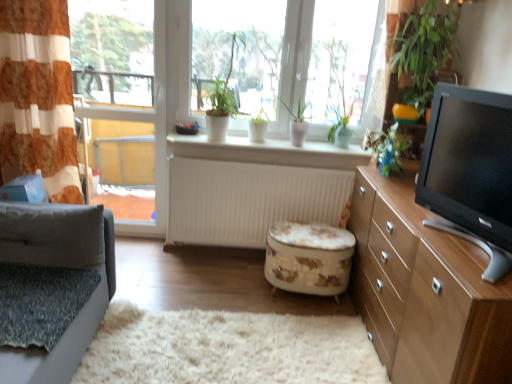
Where is `free point below green matte plant at upper right, marked as the first plant in a right-to-left arrangement (from a real-world perspective)`? The width and height of the screenshot is (512, 384). free point below green matte plant at upper right, marked as the first plant in a right-to-left arrangement (from a real-world perspective) is located at coordinates (377, 175).